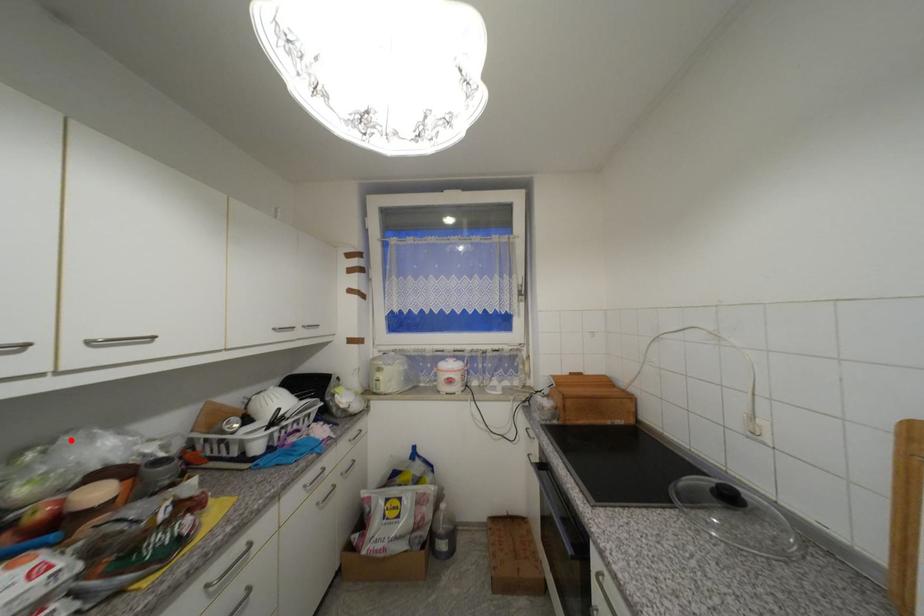
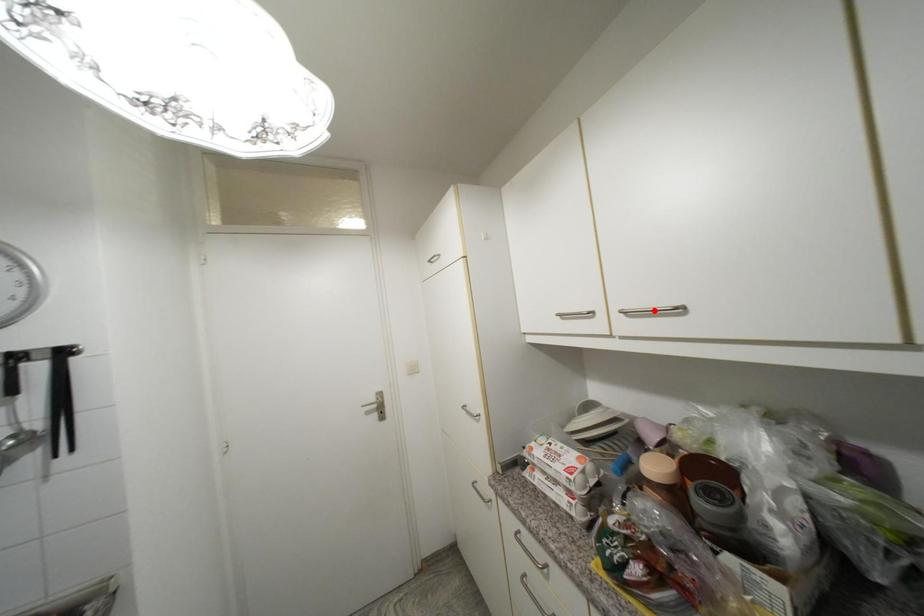
I am providing you with two images of the same scene from different viewpoints. A red point is marked on the first image and another point is marked on the second image. Do the highlighted points in image1 and image2 indicate the same real-world spot?

No